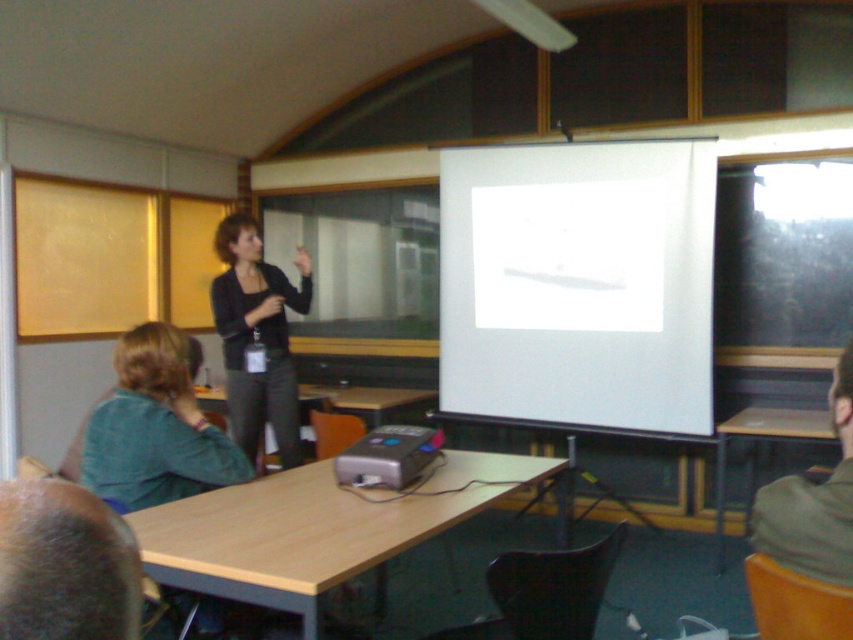
Between green fabric shirt at lower right and black fabric jacket at center, which one appears on the right side from the viewer's perspective?

green fabric shirt at lower right

Is green fabric shirt at lower right shorter than black fabric jacket at center?

Indeed, green fabric shirt at lower right has a lesser height compared to black fabric jacket at center.

Is point (798, 488) positioned before point (287, 300)?

Yes, it is in front of point (287, 300).

In order to click on green fabric shirt at lower right in this screenshot , I will do `click(807, 538)`.

The width and height of the screenshot is (853, 640). In order to click on black fabric jacket at center in this screenshot , I will do point(258,337).

Which is behind, point (225, 292) or point (358, 481)?

Point (225, 292)

At what (x,y) coordinates should I click in order to perform the action: click on black fabric jacket at center. Please return your answer as a coordinate pair (x, y). The image size is (853, 640). Looking at the image, I should click on (258, 337).

Is white matte projection screen at center to the right of wooden table at center from the viewer's perspective?

Indeed, white matte projection screen at center is positioned on the right side of wooden table at center.

Which of these two, white matte projection screen at center or wooden table at center, stands taller?

Standing taller between the two is white matte projection screen at center.

Identify the location of white matte projection screen at center. The height and width of the screenshot is (640, 853). (578, 284).

Image resolution: width=853 pixels, height=640 pixels. Identify the location of white matte projection screen at center. (578, 284).